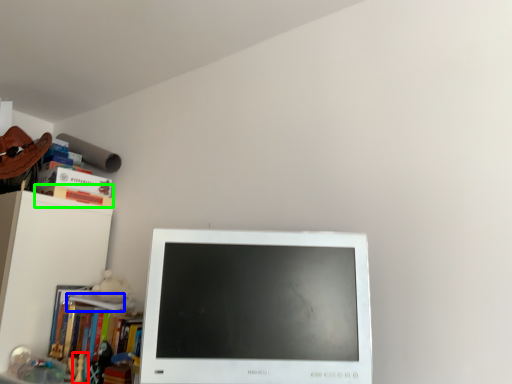
Question: Which object is positioned closest to toy (highlighted by a red box)? Select from book (highlighted by a blue box) and paperback book (highlighted by a green box).

Choices:
 (A) book
 (B) paperback book

Answer: (A)